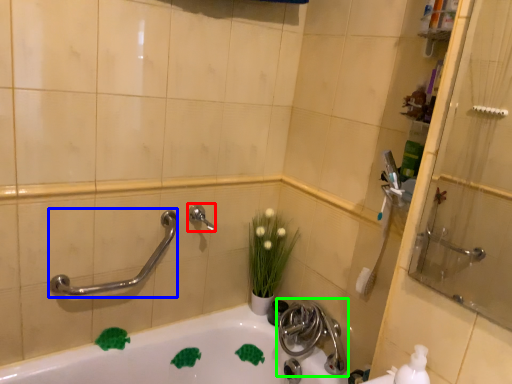
Question: Which object is positioned farthest from plumbing fixture (highlighted by a red box)? Select from shower (highlighted by a blue box) and tap (highlighted by a green box).

Choices:
 (A) shower
 (B) tap

Answer: (B)